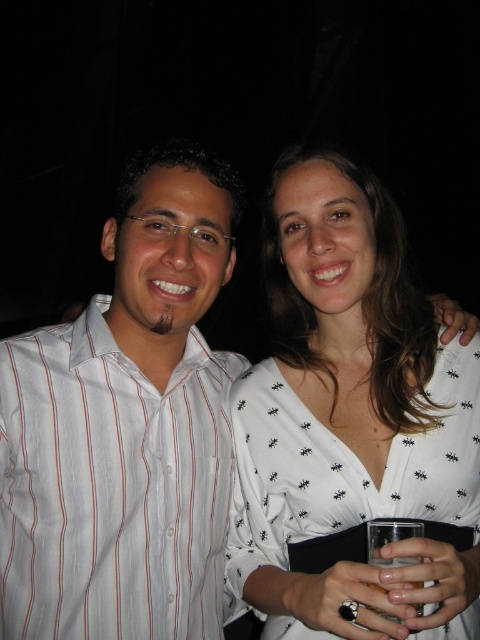
You are a photographer setting up a photo shoot. You have two main subjects wearing a white striped shirt at left and a white printed dress at center. Based on the scene description, which clothing item takes up more visual space in the image?

The white printed dress at center occupies more visual space than the white striped shirt at left according to the description.

You are standing in front of a photo where two people are posing. The man on the left is wearing a white shirt with red stripes, and the woman on the right holds a glass. There is a specific point marked at coordinates (111, 486) in the image. What object is located at this point?

The white striped shirt at left is located at point (111, 486).